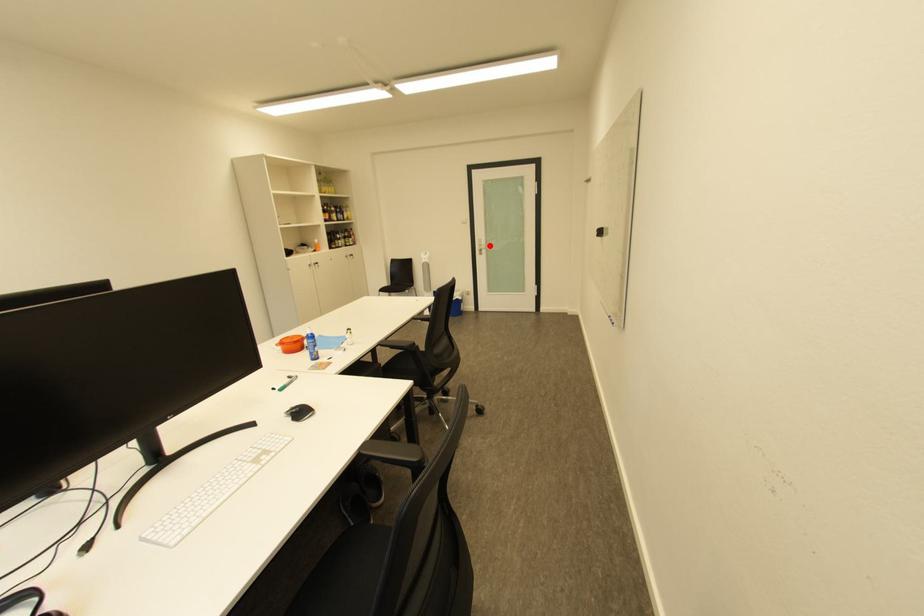
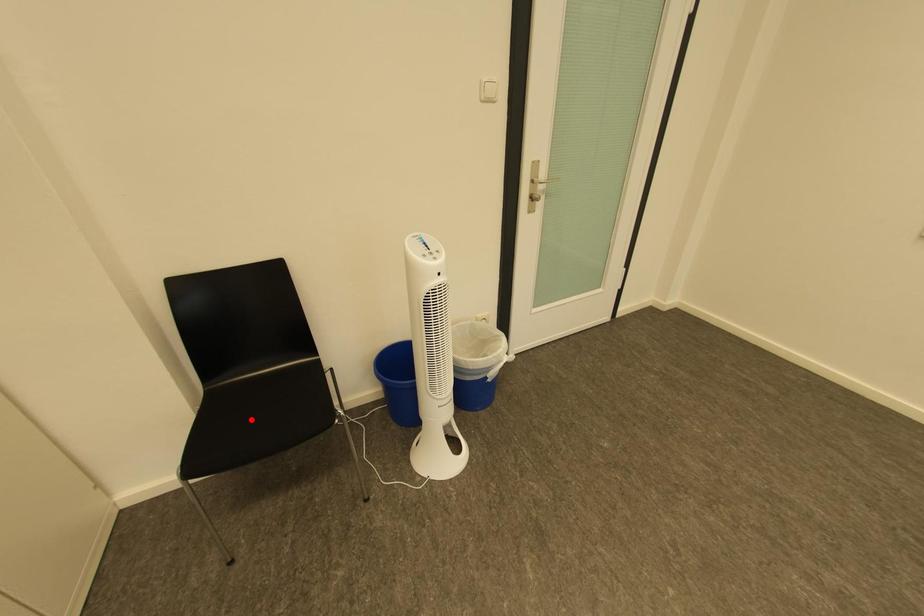
I am providing you with two images of the same scene from different viewpoints. A red point is marked on the first image and another point is marked on the second image. Does the point marked in image1 correspond to the same location as the one in image2?

No